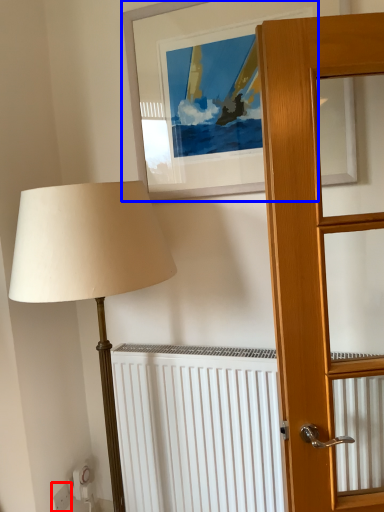
Question: Which object appears farthest to the camera in this image, electric outlet (highlighted by a red box) or picture frame (highlighted by a blue box)?

Choices:
 (A) electric outlet
 (B) picture frame

Answer: (A)